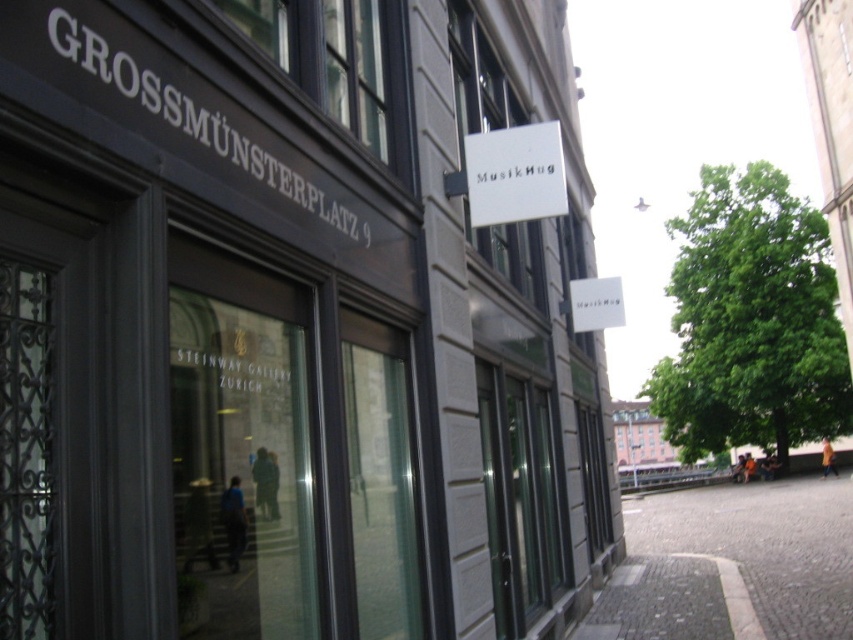
You are standing on the gray cobblestone pavement at lower right and want to enter the matte gray building at center. Which direction should you walk to reach the entrance?

The matte gray building at center is taller than the gray cobblestone pavement at lower right, so you should walk towards the building to reach the entrance.

You are standing on the street in front of the building and want to take a photo of the matte gray building at center. If you move 0.1 units to the right, will the building still be in the frame?

The matte gray building at center is located at point [296,323]. Moving 0.1 units to the right would shift your position, but since the building is centered and the frame typically allows for some margin, it should still remain in the frame unless the movement exceeds the camera field of view. However, without knowing the camera angle or field of view, it is impossible to determine definitively.

From the picture: You are standing at the entrance of the building with the sign GROSSMUNIXENPLATZ 9 and want to reach the tree with lush green foliage. There are two points marked on the path ahead of you at coordinates point (239, 394) and point (701, 586). Which point should you walk towards first to get to the tree?

You should walk towards point (239, 394) first because it is in front of point (701, 586), meaning it is closer to your starting position at the building entrance.